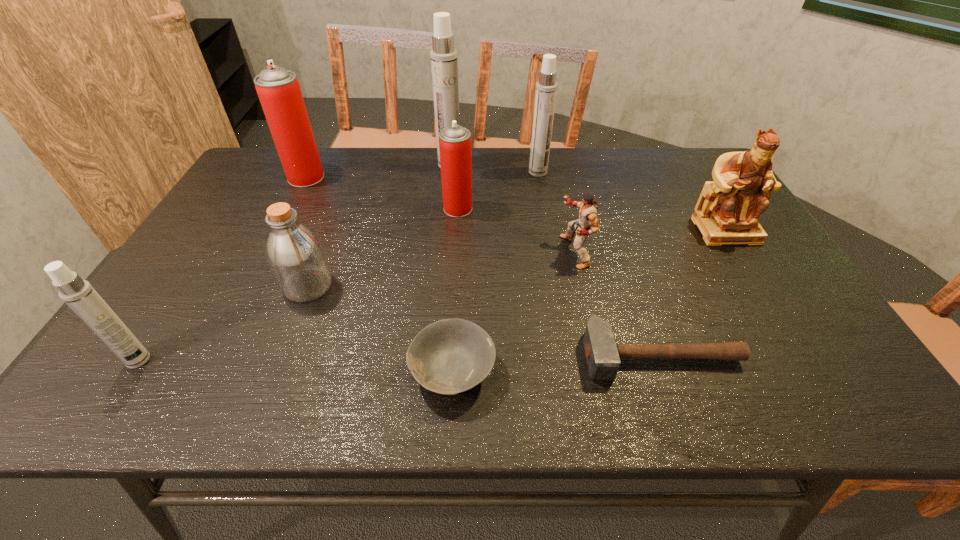
At what (x,y) coordinates should I click in order to perform the action: click on vacant space located on the front of the nearer red aerosol can. Please return your answer as a coordinate pair (x, y). Looking at the image, I should click on (452, 314).

Where is `blank area located on the back of the leftmost object`? blank area located on the back of the leftmost object is located at coordinates (190, 280).

Where is `vacant space located on the right of the seventh tallest object`? The image size is (960, 540). vacant space located on the right of the seventh tallest object is located at coordinates (362, 286).

In order to click on vacant space located 0.090m on the front-facing side of the puncher in this screenshot , I will do `click(526, 252)`.

The width and height of the screenshot is (960, 540). In order to click on vacant area located on the front-facing side of the puncher in this screenshot , I will do `click(420, 252)`.

I want to click on vacant space located 0.280m on the front-facing side of the puncher, so click(453, 252).

Identify the location of vacant region located on the left of the bowl. This screenshot has width=960, height=540. (219, 371).

Identify the location of bowl that is at the near edge. This screenshot has width=960, height=540. (449, 356).

At what (x,y) coordinates should I click in order to perform the action: click on hammer that is at the near edge. Please return your answer as a coordinate pair (x, y). The image size is (960, 540). Looking at the image, I should click on [x=603, y=355].

Where is `object located at the right edge`? Image resolution: width=960 pixels, height=540 pixels. object located at the right edge is located at coordinates (726, 213).